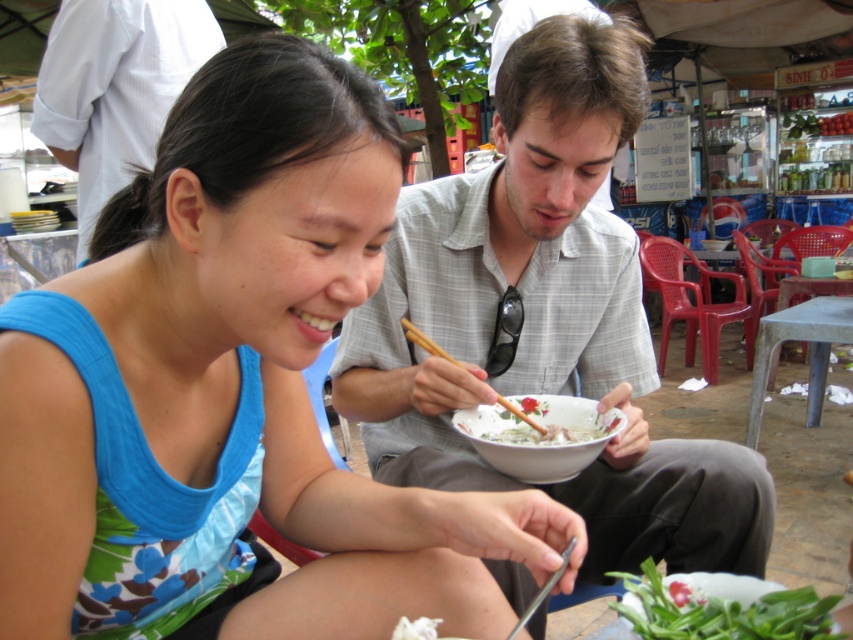
You are standing at the center of the image. There is a point at coordinates (544, 320). What object is located at that point?

The point at coordinates (544, 320) corresponds to the light gray plaid shirt at center.

You are a photographer standing at the back of the eatery. You need to capture a photo of both the white shirt at upper left and the white glossy bowl at center in the same frame. Based on their sizes, which object should you position closer to the camera to ensure both appear equally sized in the photo?

The white shirt at upper left is wider than the white glossy bowl at center. To make them appear equally sized in the photo, position the white glossy bowl at center closer to the camera since it is narrower than the white shirt at upper left.